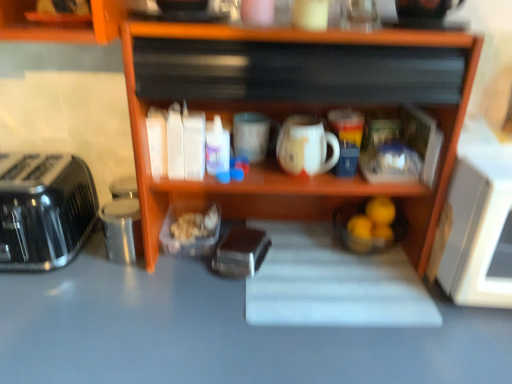
At what (x,y) coordinates should I click in order to perform the action: click on free location in front of metallic silver toaster at center. Please return your answer as a coordinate pair (x, y). This screenshot has width=512, height=384. Looking at the image, I should click on (232, 324).